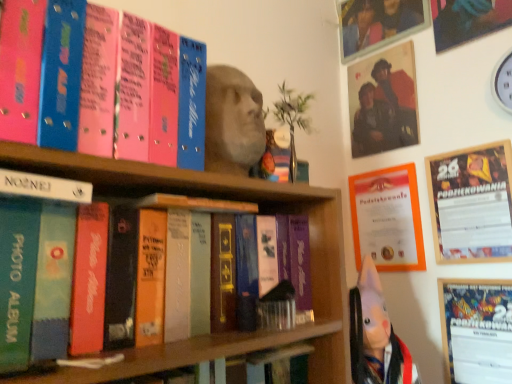
Question: Is wooden frame at upper right, the first picture frame positioned from the right, positioned behind matte plastic photo frame at upper right, arranged as the 2th picture frame when ordered from the bottom?

Choices:
 (A) yes
 (B) no

Answer: (B)

Question: Is wooden frame at upper right, the second picture frame when ordered from left to right, outside matte plastic photo frame at upper right, the first picture frame from the back?

Choices:
 (A) no
 (B) yes

Answer: (B)

Question: Is the depth of wooden frame at upper right, the second picture frame when ordered from left to right, less than that of matte plastic photo frame at upper right, acting as the 2th picture frame starting from the front?

Choices:
 (A) yes
 (B) no

Answer: (A)

Question: From the image's perspective, is wooden frame at upper right, which is the 2th picture frame in top-to-bottom order, on matte plastic photo frame at upper right, the first picture frame viewed from the left?

Choices:
 (A) no
 (B) yes

Answer: (A)

Question: Is wooden frame at upper right, marked as the 2th picture frame in a back-to-front arrangement, smaller than matte plastic photo frame at upper right, placed as the first picture frame when sorted from top to bottom?

Choices:
 (A) no
 (B) yes

Answer: (B)

Question: Would you say matte plastic photo frame at upper right, placed as the first picture frame when sorted from top to bottom, is part of wooden frame at upper right, the first picture frame positioned from the right,'s contents?

Choices:
 (A) yes
 (B) no

Answer: (B)

Question: From the image's perspective, is matte plastic photo frame at upper right, placed as the first picture frame when sorted from top to bottom, below pink matte photo album at upper left, the 1th book positioned from the top?

Choices:
 (A) yes
 (B) no

Answer: (B)

Question: Considering the relative sizes of matte plastic photo frame at upper right, arranged as the 2th picture frame when ordered from the bottom, and pink matte photo album at upper left, the 1th book positioned from the top, in the image provided, is matte plastic photo frame at upper right, arranged as the 2th picture frame when ordered from the bottom, smaller than pink matte photo album at upper left, the 1th book positioned from the top,?

Choices:
 (A) yes
 (B) no

Answer: (A)

Question: Is matte plastic photo frame at upper right, the first picture frame viewed from the left, oriented towards pink matte photo album at upper left, positioned as the second book in bottom-to-top order?

Choices:
 (A) no
 (B) yes

Answer: (B)

Question: Does matte plastic photo frame at upper right, arranged as the 2th picture frame when ordered from the bottom, have a lesser height compared to pink matte photo album at upper left, positioned as the second book in bottom-to-top order?

Choices:
 (A) yes
 (B) no

Answer: (B)

Question: Is matte plastic photo frame at upper right, placed as the first picture frame when sorted from top to bottom, further to the viewer compared to pink matte photo album at upper left, the 1th book positioned from the top?

Choices:
 (A) yes
 (B) no

Answer: (A)

Question: Is matte plastic photo frame at upper right, placed as the first picture frame when sorted from top to bottom, located outside pink matte photo album at upper left, the 1th book positioned from the top?

Choices:
 (A) no
 (B) yes

Answer: (B)

Question: Is orange paper certificate at upper right located outside white plastic clock at upper right?

Choices:
 (A) yes
 (B) no

Answer: (A)